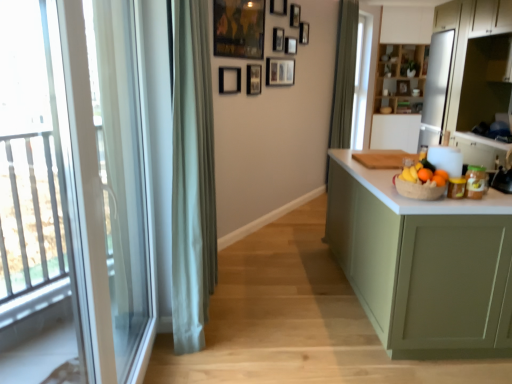
Question: From the image's perspective, is black matte picture frame at upper center, positioned as the 10th picture frame in right-to-left order, beneath white matte cabinet at upper right, which ranks as the 3th cabinetry in back-to-front order?

Choices:
 (A) no
 (B) yes

Answer: (B)

Question: Is black matte picture frame at upper center, positioned as the 10th picture frame in right-to-left order, closer to the viewer compared to white matte cabinet at upper right, the third cabinetry when ordered from left to right?

Choices:
 (A) no
 (B) yes

Answer: (B)

Question: Is black matte picture frame at upper center, placed as the second picture frame when sorted from front to back, to the right of white matte cabinet at upper right, acting as the second cabinetry starting from the front, from the viewer's perspective?

Choices:
 (A) yes
 (B) no

Answer: (B)

Question: From a real-world perspective, is black matte picture frame at upper center, positioned as the 10th picture frame in right-to-left order, physically above white matte cabinet at upper right, the third cabinetry when ordered from left to right?

Choices:
 (A) no
 (B) yes

Answer: (A)

Question: Considering the relative sizes of black matte picture frame at upper center, placed as the second picture frame when sorted from front to back, and white matte cabinet at upper right, acting as the second cabinetry starting from the front, in the image provided, is black matte picture frame at upper center, placed as the second picture frame when sorted from front to back, smaller than white matte cabinet at upper right, acting as the second cabinetry starting from the front,?

Choices:
 (A) no
 (B) yes

Answer: (B)

Question: Visually, is matte black picture frame at upper center, which is the third picture frame from front to back, positioned to the left or to the right of wooden picture frame at upper center, the sixth picture frame when ordered from right to left?

Choices:
 (A) right
 (B) left

Answer: (B)

Question: Based on their sizes in the image, would you say matte black picture frame at upper center, the 8th picture frame viewed from the back, is bigger or smaller than wooden picture frame at upper center, which is the fifth picture frame from left to right?

Choices:
 (A) big
 (B) small

Answer: (A)

Question: Considering the positions of matte black picture frame at upper center, the 8th picture frame viewed from the back, and wooden picture frame at upper center, the 5th picture frame from the back, in the image, is matte black picture frame at upper center, the 8th picture frame viewed from the back, wider or thinner than wooden picture frame at upper center, the 5th picture frame from the back,?

Choices:
 (A) wide
 (B) thin

Answer: (B)

Question: Considering the positions of matte black picture frame at upper center, the eighth picture frame viewed from the right, and wooden picture frame at upper center, the 5th picture frame from the back, in the image, is matte black picture frame at upper center, the eighth picture frame viewed from the right, taller or shorter than wooden picture frame at upper center, the 5th picture frame from the back,?

Choices:
 (A) tall
 (B) short

Answer: (A)

Question: Considering the positions of green fabric curtain at center, which ranks as the second curtain in right-to-left order, and orange matte at right, the 1th orange when ordered from right to left, in the image, is green fabric curtain at center, which ranks as the second curtain in right-to-left order, bigger or smaller than orange matte at right, the 1th orange when ordered from right to left,?

Choices:
 (A) small
 (B) big

Answer: (B)

Question: Considering the positions of point (203, 125) and point (438, 168), is point (203, 125) closer or farther from the camera than point (438, 168)?

Choices:
 (A) closer
 (B) farther

Answer: (B)

Question: Is green fabric curtain at center, the first curtain in the front-to-back sequence, taller or shorter than orange matte at right, placed as the third orange when sorted from left to right?

Choices:
 (A) short
 (B) tall

Answer: (B)

Question: Is green fabric curtain at center, positioned as the 1th curtain in left-to-right order, inside or outside of orange matte at right, the 1th orange when ordered from right to left?

Choices:
 (A) outside
 (B) inside

Answer: (A)

Question: From the image's perspective, is green matte cabinet at right, which is counted as the 1th cabinetry, starting from the left, positioned above or below wooden picture frame at upper center, the 1th picture frame positioned from the right?

Choices:
 (A) below
 (B) above

Answer: (A)

Question: Is green matte cabinet at right, which appears as the fourth cabinetry when viewed from the right, wider or thinner than wooden picture frame at upper center, the 1th picture frame viewed from the back?

Choices:
 (A) wide
 (B) thin

Answer: (A)